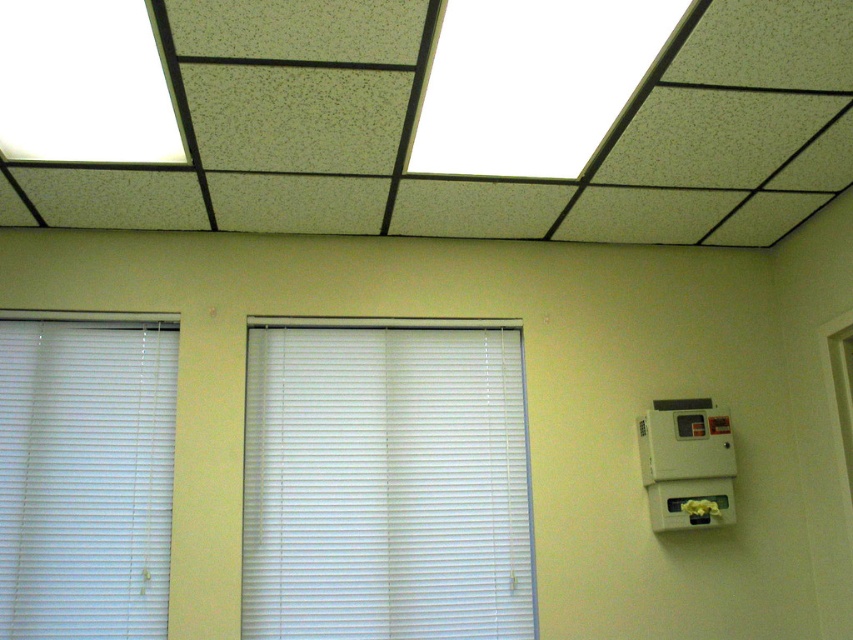
You are an office worker who wants to adjust the white plastic blinds at center and the white plastic blinds at left to allow more natural light into the room. Given that both blinds are closed, which set of blinds would you need to adjust more to achieve this goal?

The white plastic blinds at center is bigger than white plastic blinds at left, so you would need to adjust the white plastic blinds at center more to allow more natural light into the room since it has a larger surface area to open.

You are an office worker who needs to adjust the white plastic blinds at center and the white plastic blinds at left. If you want to open both sets of blinds simultaneously, will you be able to reach both handles comfortably from your current position standing at the desk?

The white plastic blinds at center is 28.09 inches from white plastic blinds at left, so yes, you can reach both handles comfortably from your current position standing at the desk since the distance between them is within a typical comfortable reach range.